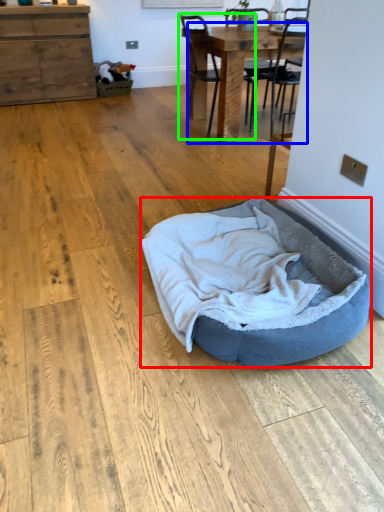
Question: Estimate the real-world distances between objects in this image. Which object is farther from dog bed (highlighted by a red box), table (highlighted by a blue box) or chair (highlighted by a green box)?

Choices:
 (A) table
 (B) chair

Answer: (B)